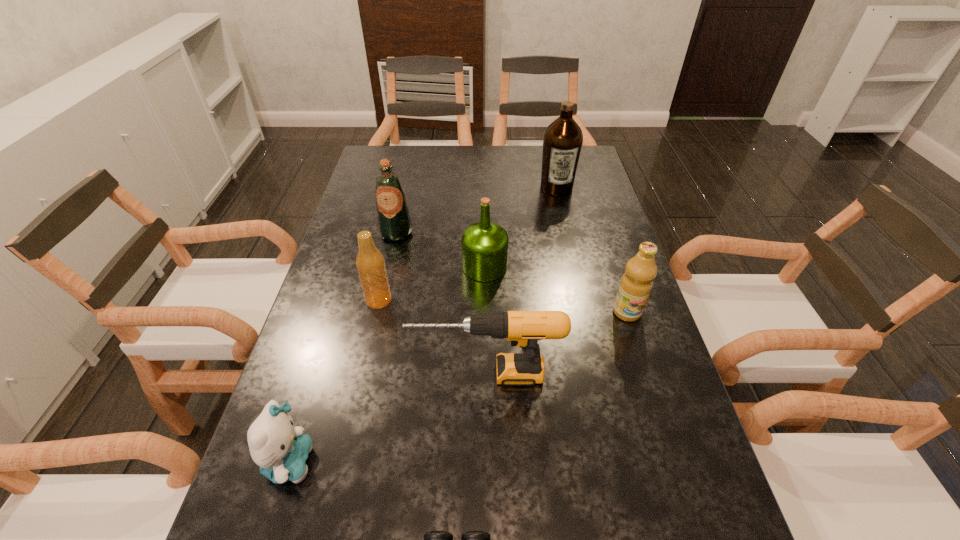
Find the location of a particular element. free space between the beer bottle and the second farthest olive oil is located at coordinates (388, 266).

I want to click on blank region between the farthest object and the third olive oil from right to left, so click(520, 227).

This screenshot has width=960, height=540. In order to click on vacant area between the sixth nearest object and the beer bottle in this screenshot , I will do `click(432, 283)`.

Locate an element on the screen. The image size is (960, 540). empty space between the kitten and the beer bottle is located at coordinates (334, 381).

This screenshot has width=960, height=540. Find the location of `the second closest object to the beer bottle`. the second closest object to the beer bottle is located at coordinates (484, 244).

Point out which object is positioned as the fifth nearest to the seventh nearest object. Please provide its 2D coordinates. Your answer should be formatted as a tuple, i.e. [(x, y)], where the tuple contains the x and y coordinates of a point satisfying the conditions above.

[(636, 284)]

What are the coordinates of `olive oil that is the closest to the sixth farthest object` in the screenshot? It's located at (636, 284).

Identify the location of olive oil that is the second closest one to the seventh nearest object. This screenshot has height=540, width=960. (562, 141).

Where is `free space that satisfies the following two spatial constraints: 1. on the front-facing side of the third olive oil from right to left; 2. on the right side of the second farthest object`? free space that satisfies the following two spatial constraints: 1. on the front-facing side of the third olive oil from right to left; 2. on the right side of the second farthest object is located at coordinates (389, 267).